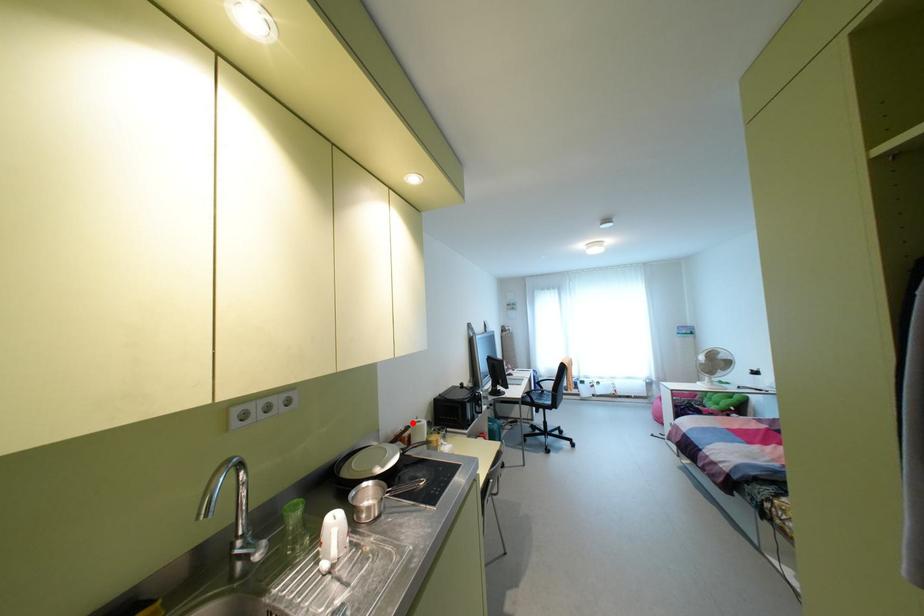
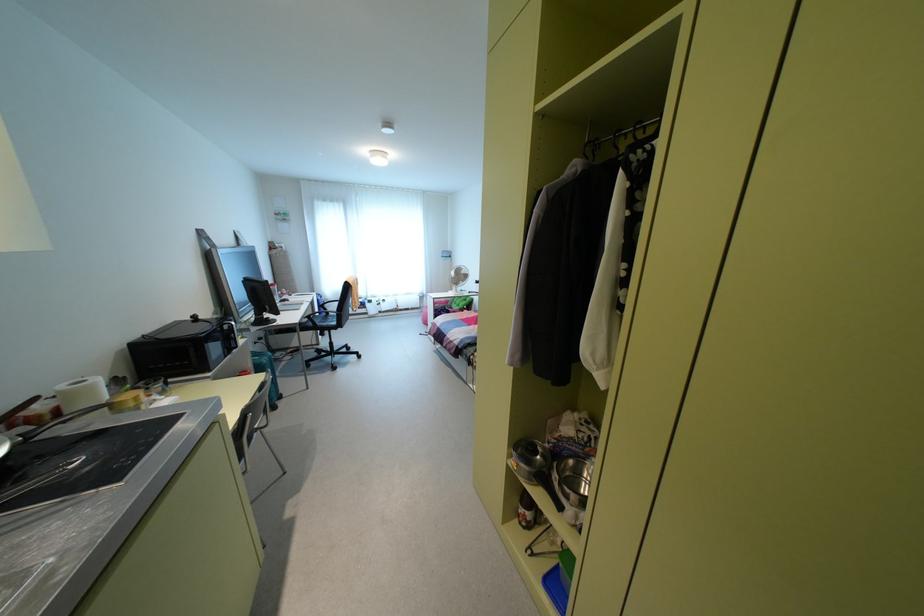
Question: I am providing you with two images of the same scene from different viewpoints. In image1, a red point is highlighted. Considering the same 3D point in image2, which of the following is correct?

Choices:
 (A) It is closer
 (B) It is farther

Answer: (B)